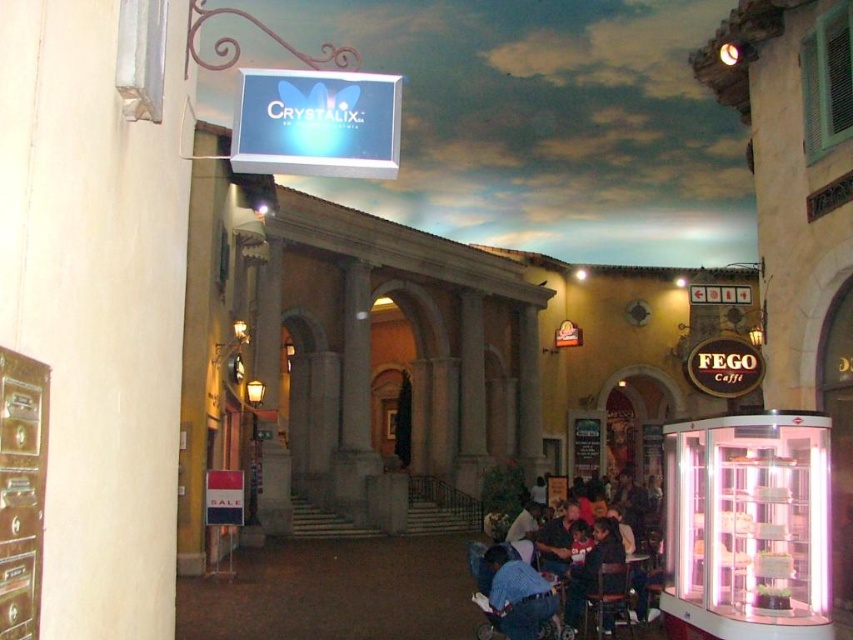
Does blue denim shirt at center have a smaller size compared to dark blue shirt at lower right?

No.

Between blue denim shirt at center and dark blue shirt at lower right, which one is positioned higher?

blue denim shirt at center is above.

Is point (622, 563) closer to camera compared to point (598, 548)?

That is True.

Where is `blue denim shirt at center`? blue denim shirt at center is located at coordinates (584, 560).

How distant is blue denim shirt at center from blue denim shirt at lower center?

blue denim shirt at center and blue denim shirt at lower center are 23.15 feet apart.

The image size is (853, 640). Identify the location of blue denim shirt at center. (584, 560).

What are the coordinates of `blue denim shirt at center` in the screenshot? It's located at (584, 560).

You are a GUI agent. You are given a task and a screenshot of the screen. Output one action in this format:
    pyautogui.click(x=<x>, y=<y>)
    Task: Click on the blue denim shirt at lower center
    The image size is (853, 640).
    Given the screenshot: What is the action you would take?
    pyautogui.click(x=517, y=595)

Who is lower down, blue denim shirt at lower center or dark blue shirt at lower right?

dark blue shirt at lower right is below.

Is point (540, 596) positioned before point (567, 595)?

Yes, point (540, 596) is closer to viewer.

Identify the location of blue denim shirt at lower center. (517, 595).